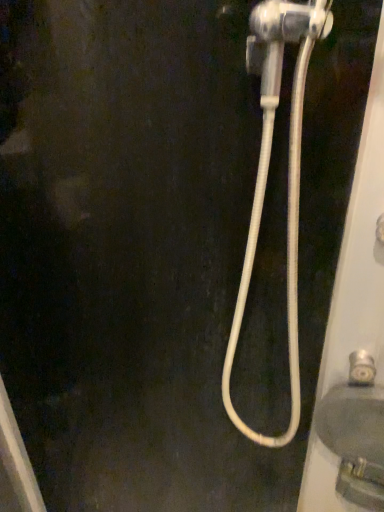
What do you see at coordinates (361, 368) in the screenshot? The image size is (384, 512). I see `silver metallic faucet at lower right` at bounding box center [361, 368].

What is the approximate width of silver metallic faucet at lower right?

It is 4.58 centimeters.

Find the location of a particular element. This screenshot has height=512, width=384. matte gray sink at lower right is located at coordinates (356, 433).

Is white rubber hose at right at the back of silver metallic faucet at lower right?

That's not correct — silver metallic faucet at lower right is not looking away from white rubber hose at right.

Would you say silver metallic faucet at lower right is inside or outside white rubber hose at right?

silver metallic faucet at lower right exists outside the volume of white rubber hose at right.

Considering the relative positions of silver metallic faucet at lower right and white rubber hose at right in the image provided, is silver metallic faucet at lower right in front of white rubber hose at right?

That is False.

From a real-world perspective, who is located higher, silver metallic faucet at lower right or white rubber hose at right?

white rubber hose at right, from a real-world perspective.

Is silver metallic faucet at lower right shorter than matte gray sink at lower right?

Correct, silver metallic faucet at lower right is not as tall as matte gray sink at lower right.

From the image's perspective, which one is positioned lower, silver metallic faucet at lower right or matte gray sink at lower right?

matte gray sink at lower right appears lower in the image.

Does silver metallic faucet at lower right have a lesser width compared to matte gray sink at lower right?

Yes, silver metallic faucet at lower right is thinner than matte gray sink at lower right.

Which of these two, silver metallic faucet at lower right or matte gray sink at lower right, is bigger?

Bigger between the two is matte gray sink at lower right.

Does matte gray sink at lower right have a lesser width compared to white rubber hose at right?

Yes.

Find the location of a particular element. plumbing fixture that appears above the matte gray sink at lower right (from the image's perspective) is located at coordinates (267, 174).

How many degrees apart are the facing directions of matte gray sink at lower right and white rubber hose at right?

The angular difference between matte gray sink at lower right and white rubber hose at right is 48.3 degrees.

Looking at this image, does matte gray sink at lower right appear on the right side of white rubber hose at right?

Indeed, matte gray sink at lower right is positioned on the right side of white rubber hose at right.

Is point (255, 39) positioned after point (376, 496)?

No, it is not.

Considering the sizes of objects white rubber hose at right and matte gray sink at lower right in the image provided, who is shorter, white rubber hose at right or matte gray sink at lower right?

matte gray sink at lower right.

Consider the image. Can you confirm if white rubber hose at right is thinner than matte gray sink at lower right?

No, white rubber hose at right is not thinner than matte gray sink at lower right.

Is white rubber hose at right in front of matte gray sink at lower right?

Yes, white rubber hose at right is closer to the camera.

From the image's perspective, does matte gray sink at lower right appear higher than silver metallic faucet at lower right?

Actually, matte gray sink at lower right appears below silver metallic faucet at lower right in the image.

Is point (341, 486) positioned before point (353, 353)?

No, it is behind (353, 353).

Is matte gray sink at lower right further to camera compared to silver metallic faucet at lower right?

No, it is in front of silver metallic faucet at lower right.

Which object is more forward, white rubber hose at right or silver metallic faucet at lower right?

white rubber hose at right is in front.

What's the angular difference between white rubber hose at right and silver metallic faucet at lower right's facing directions?

The facing directions of white rubber hose at right and silver metallic faucet at lower right are 48.3 degrees apart.

Is silver metallic faucet at lower right surrounded by white rubber hose at right?

No, silver metallic faucet at lower right is not a part of white rubber hose at right.

Is white rubber hose at right positioned with its back to silver metallic faucet at lower right?

No, white rubber hose at right's orientation is not away from silver metallic faucet at lower right.

At what (x,y) coordinates should I click in order to perform the action: click on plumbing fixture that appears above the silver metallic faucet at lower right (from the image's perspective). Please return your answer as a coordinate pair (x, y). The image size is (384, 512). Looking at the image, I should click on (267, 174).

At what (x,y) coordinates should I click in order to perform the action: click on faucet above the matte gray sink at lower right (from a real-world perspective). Please return your answer as a coordinate pair (x, y). Image resolution: width=384 pixels, height=512 pixels. Looking at the image, I should click on (361, 368).

Which object lies nearer to the anchor point matte gray sink at lower right, silver metallic faucet at lower right or white rubber hose at right?

Based on the image, silver metallic faucet at lower right appears to be nearer to matte gray sink at lower right.

In the scene shown: Based on their spatial positions, is matte gray sink at lower right or white rubber hose at right closer to silver metallic faucet at lower right?

matte gray sink at lower right lies closer to silver metallic faucet at lower right than the other object.

When comparing their distances from silver metallic faucet at lower right, does white rubber hose at right or matte gray sink at lower right seem further?

white rubber hose at right is positioned further to the anchor silver metallic faucet at lower right.

Estimate the real-world distances between objects in this image. Which object is closer to white rubber hose at right, silver metallic faucet at lower right or matte gray sink at lower right?

matte gray sink at lower right is closer to white rubber hose at right.

From the image, which object appears to be farther from white rubber hose at right, matte gray sink at lower right or silver metallic faucet at lower right?

silver metallic faucet at lower right lies further to white rubber hose at right than the other object.

Looking at the image, which one is located closer to matte gray sink at lower right, white rubber hose at right or silver metallic faucet at lower right?

silver metallic faucet at lower right is closer to matte gray sink at lower right.

This screenshot has width=384, height=512. What are the coordinates of `sink between white rubber hose at right and silver metallic faucet at lower right from front to back` in the screenshot? It's located at (356, 433).